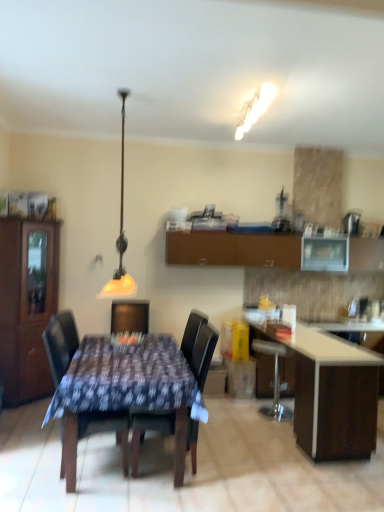
Question: From a real-world perspective, is wooden table at center positioned above or below dark brown leather chair at center, the 1th chair positioned from the right?

Choices:
 (A) above
 (B) below

Answer: (B)

Question: Looking at the image, does wooden table at center seem bigger or smaller compared to dark brown leather chair at center, arranged as the second chair when viewed from the left?

Choices:
 (A) big
 (B) small

Answer: (A)

Question: Estimate the real-world distances between objects in this image. Which object is closer to the brown wood cabinet at left, the second cabinetry viewed from the back?

Choices:
 (A) black plastic blender at upper right
 (B) white frosted glass light fixture at upper center
 (C) brown matte cabinet at upper center, the first cabinetry viewed from the right
 (D) white glossy table at lower right
 (E) dark brown leather chair at center, arranged as the second chair when viewed from the left

Answer: (C)

Question: Which object is positioned farthest from the brown wood cabinet at left, the second cabinetry viewed from the back?

Choices:
 (A) black plastic blender at upper right
 (B) wooden table at center
 (C) white glossy countertop at right
 (D) black wood chair at center, marked as the 1th chair in a left-to-right arrangement
 (E) dark brown leather chair at center, arranged as the second chair when viewed from the left

Answer: (A)